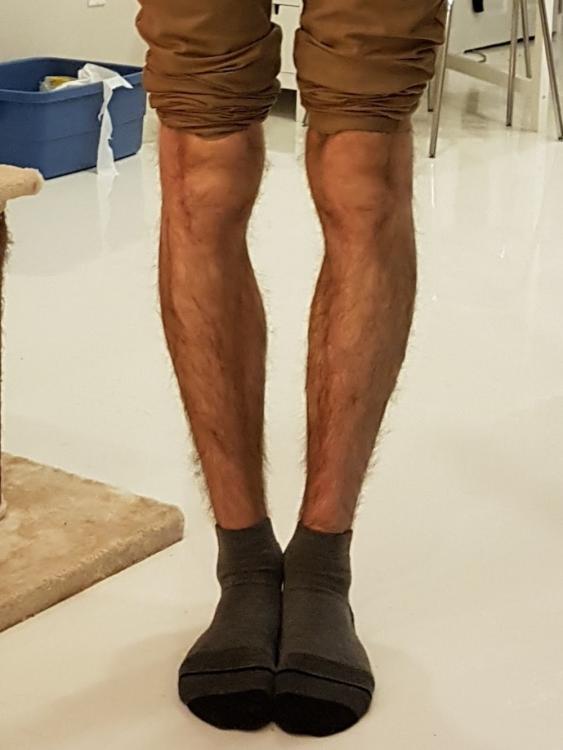
Find the location of a particular element. This screenshot has height=750, width=563. side white wall is located at coordinates (50, 24).